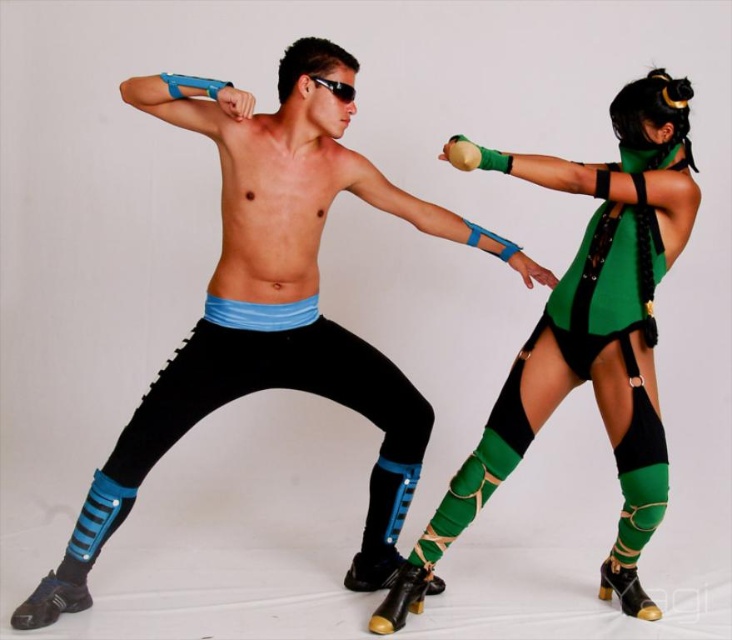
Question: Is black matte pants at center smaller than green matte/leather outfit at upper right?

Choices:
 (A) yes
 (B) no

Answer: (B)

Question: Is black matte pants at center behind green matte/leather outfit at upper right?

Choices:
 (A) yes
 (B) no

Answer: (B)

Question: Among these objects, which one is farthest from the camera?

Choices:
 (A) green matte/leather outfit at upper right
 (B) black matte pants at center

Answer: (A)

Question: Among these objects, which one is nearest to the camera?

Choices:
 (A) green matte/leather outfit at upper right
 (B) black matte pants at center

Answer: (B)

Question: Is black matte pants at center wider than green matte/leather outfit at upper right?

Choices:
 (A) no
 (B) yes

Answer: (B)